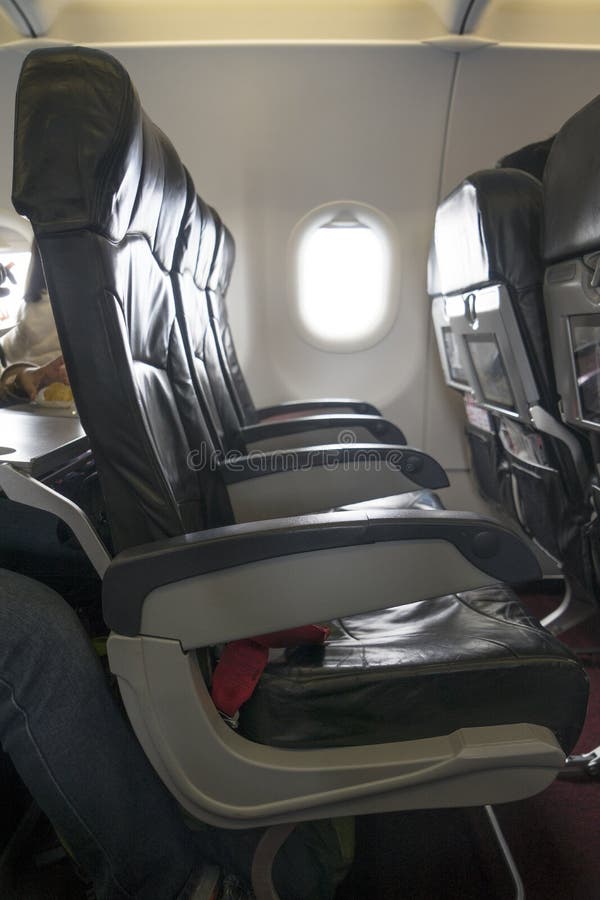
Where is `chair`? chair is located at coordinates (175, 498), (196, 329), (222, 315), (482, 274), (436, 322), (573, 280).